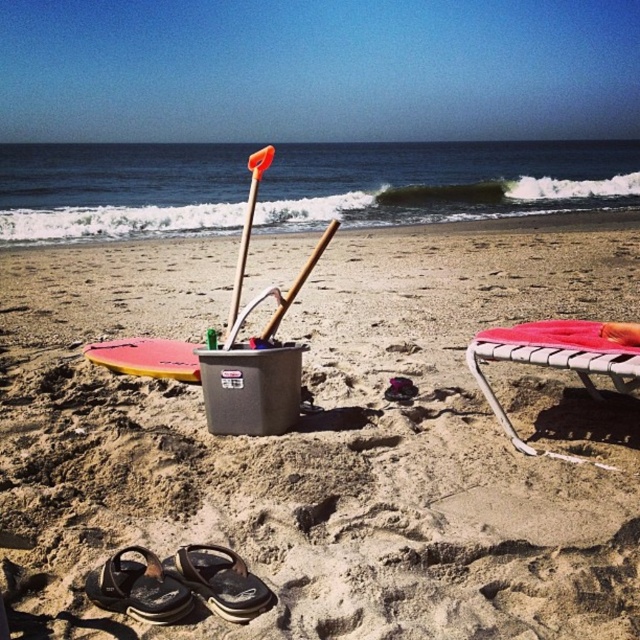
Question: Which point appears farthest from the camera in this image?

Choices:
 (A) (182, 570)
 (B) (145, 548)

Answer: (B)

Question: Is the position of matte plastic bucket at center more distant than that of yellow matte surfboard at lower left?

Choices:
 (A) no
 (B) yes

Answer: (A)

Question: Which of the following is the closest to the observer?

Choices:
 (A) pink fabric chair at right
 (B) matte plastic bucket at center
 (C) yellow matte surfboard at lower left

Answer: (B)

Question: Does matte plastic bucket at center have a smaller size compared to pink fabric chair at right?

Choices:
 (A) yes
 (B) no

Answer: (B)

Question: Which of the following is the farthest from the observer?

Choices:
 (A) matte plastic bucket at center
 (B) wooden shovel at center

Answer: (B)

Question: Does matte plastic bucket at center lie behind orange plastic shovel at center?

Choices:
 (A) no
 (B) yes

Answer: (A)